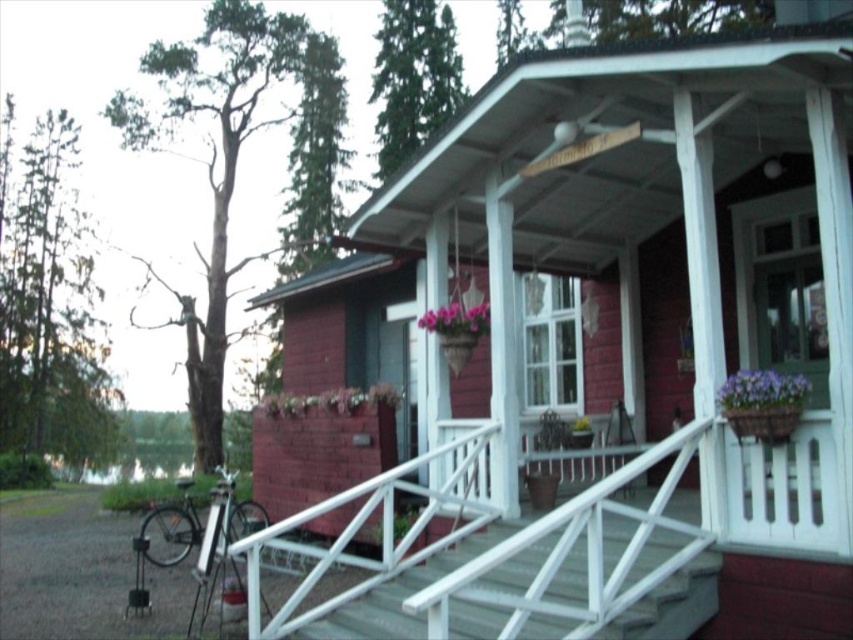
You are a delivery person trying to park your van next to the purple matte flower pot at right. The van is 2 meters wide. Can the van fit between the white painted wood porch at center and the flower pot?

The white painted wood porch at center is wider than the purple matte flower pot at right. However, the description does not provide specific measurements of their widths or the space between them. Therefore, it is unclear if the van can fit in that area.

Based on the photo, you are a delivery person carrying a package that requires a 5 feet clearance to maneuver. You need to move from the front yard to the porch by passing between the white wooden stairs at center and the purple matte flower pot at right. Can you safely navigate through the space between them with your package?

The distance between the white wooden stairs at center and the purple matte flower pot at right is 4.53 feet, which is less than the required 5 feet clearance. Therefore, you cannot safely navigate through the space with your package.

Based on the photo, you are a delivery person trying to place a package on the white painted wood porch at center and the purple matte flower pot at right. Which surface can you place the package on without it being too small?

The white painted wood porch at center is bigger than the purple matte flower pot at right, so the package can be placed on the white painted wood porch at center since it is larger and can accommodate the package.